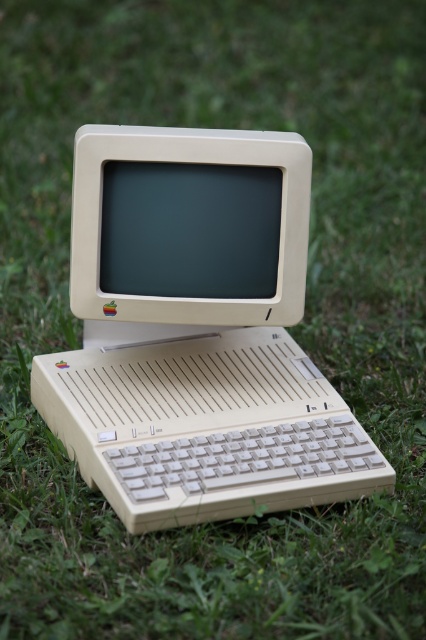
You are standing in a park and see the beige plastic computer at center and the beige plastic monitor at center. Which one is positioned to the right?

The beige plastic computer at center is positioned to the right of the beige plastic monitor at center.

You are standing in a park and see a beige plastic computer at center. Where is the beige plastic computer located relative to the point at coordinates (195, 332)?

The beige plastic computer at center is located exactly at the point with coordinates (195, 332).